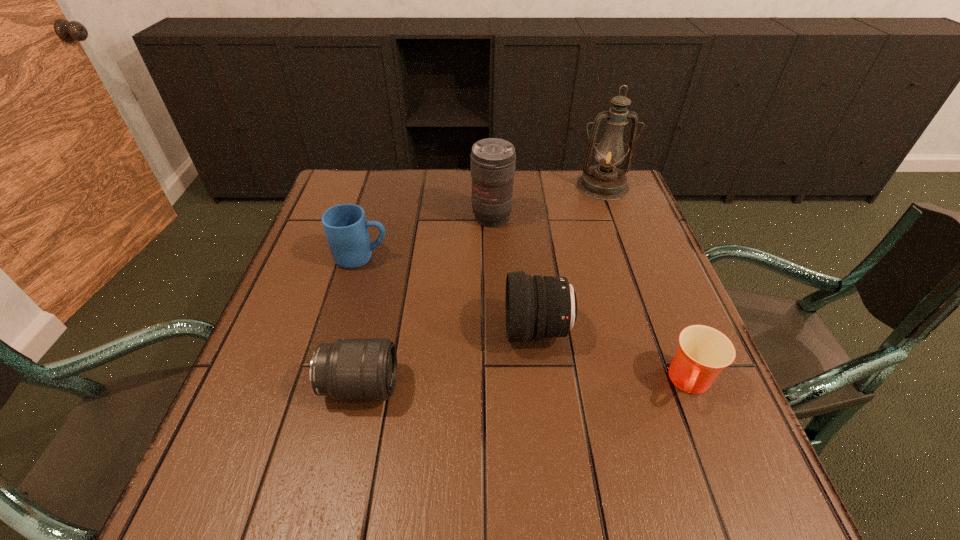
You are a GUI agent. You are given a task and a screenshot of the screen. Output one action in this format:
    pyautogui.click(x=<x>, y=<y>)
    Task: Click on the telephoto lens at the left edge
    This screenshot has height=540, width=960.
    Given the screenshot: What is the action you would take?
    pyautogui.click(x=349, y=369)

The width and height of the screenshot is (960, 540). In order to click on oil lamp that is at the right edge in this screenshot , I will do click(x=604, y=182).

The height and width of the screenshot is (540, 960). Find the location of `cup present at the right edge`. cup present at the right edge is located at coordinates (703, 352).

At what (x,y) coordinates should I click in order to perform the action: click on object at the far right corner. Please return your answer as a coordinate pair (x, y). This screenshot has width=960, height=540. Looking at the image, I should click on (604, 182).

Image resolution: width=960 pixels, height=540 pixels. In the image, there is a desktop. In order to click on free region at the far edge in this screenshot , I will do `click(458, 188)`.

I want to click on vacant space at the near edge of the desktop, so click(371, 471).

The height and width of the screenshot is (540, 960). What are the coordinates of `free space at the left edge of the desktop` in the screenshot? It's located at (281, 403).

Image resolution: width=960 pixels, height=540 pixels. Identify the location of vacant space at the right edge of the desktop. (629, 326).

Locate an element on the screen. The height and width of the screenshot is (540, 960). vacant area at the near left corner is located at coordinates coord(262,498).

You are a GUI agent. You are given a task and a screenshot of the screen. Output one action in this format:
    pyautogui.click(x=<x>, y=<y>)
    Task: Click on the vacant space at the far right corner of the desktop
    Image resolution: width=960 pixels, height=540 pixels.
    Given the screenshot: What is the action you would take?
    [x=628, y=208]